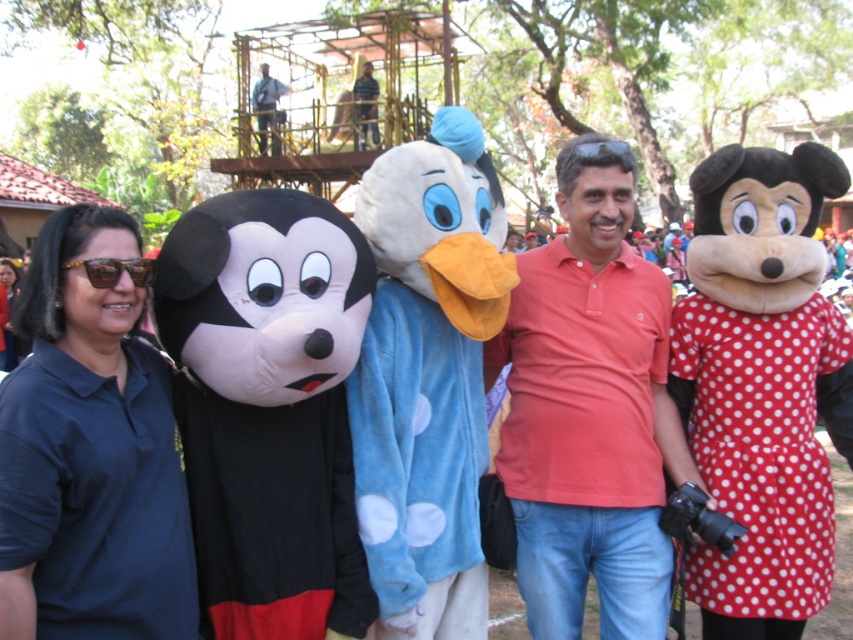
Question: Is polka dot fabric minnie mouse at right above dark blue shirt at left?

Choices:
 (A) yes
 (B) no

Answer: (A)

Question: Which of the following is the farthest from the observer?

Choices:
 (A) (273, 81)
 (B) (543, 266)
 (C) (125, 225)
 (D) (262, 554)

Answer: (A)

Question: Does matte red shirt at center come in front of blue denim jeans at upper center?

Choices:
 (A) yes
 (B) no

Answer: (A)

Question: Which object appears farthest from the camera in this image?

Choices:
 (A) black plush mickey mouse head at left
 (B) polka dot fabric minnie mouse at right
 (C) dark blue shirt at left
 (D) blue denim jeans at upper center

Answer: (D)

Question: Does blue plush duck at center appear over blue denim jeans at upper center?

Choices:
 (A) no
 (B) yes

Answer: (A)

Question: Which point appears closest to the camera in this image?

Choices:
 (A) (318, 534)
 (B) (276, 148)

Answer: (A)